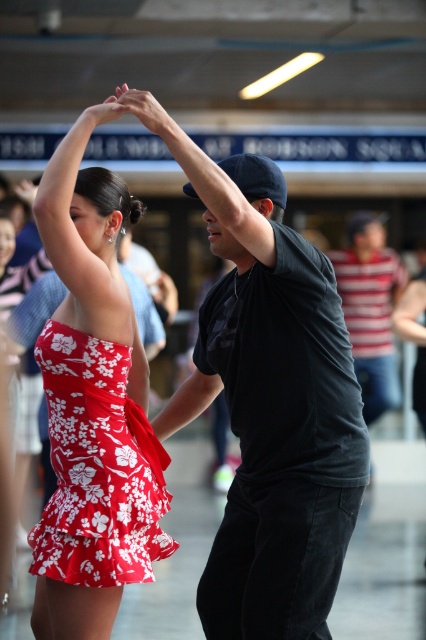
Who is positioned more to the right, matte floral dress at center or striped cotton shirt at right?

striped cotton shirt at right is more to the right.

Which is behind, point (89, 620) or point (377, 298)?

The point (377, 298) is behind.

In order to click on matte floral dress at center in this screenshot , I will do `click(92, 404)`.

Who is higher up, black cotton t-shirt at center or striped cotton shirt at right?

striped cotton shirt at right is higher up.

Between black cotton t-shirt at center and striped cotton shirt at right, which one appears on the right side from the viewer's perspective?

From the viewer's perspective, striped cotton shirt at right appears more on the right side.

The height and width of the screenshot is (640, 426). I want to click on black cotton t-shirt at center, so click(x=270, y=410).

Who is positioned more to the right, black cotton t-shirt at center or red floral fabric dress at center?

From the viewer's perspective, black cotton t-shirt at center appears more on the right side.

Which of these two, black cotton t-shirt at center or red floral fabric dress at center, stands shorter?

Standing shorter between the two is red floral fabric dress at center.

Is point (314, 326) farther from camera compared to point (55, 401)?

No, (314, 326) is in front of (55, 401).

Locate an element on the screen. The height and width of the screenshot is (640, 426). black cotton t-shirt at center is located at coordinates (270, 410).